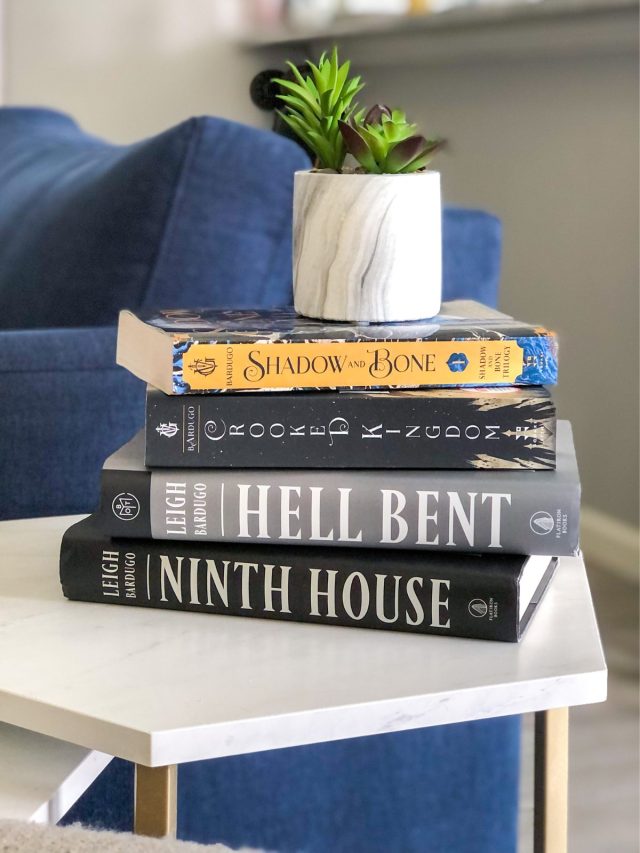
Find the location of a particular element. This screenshot has height=853, width=640. wall is located at coordinates (573, 149).